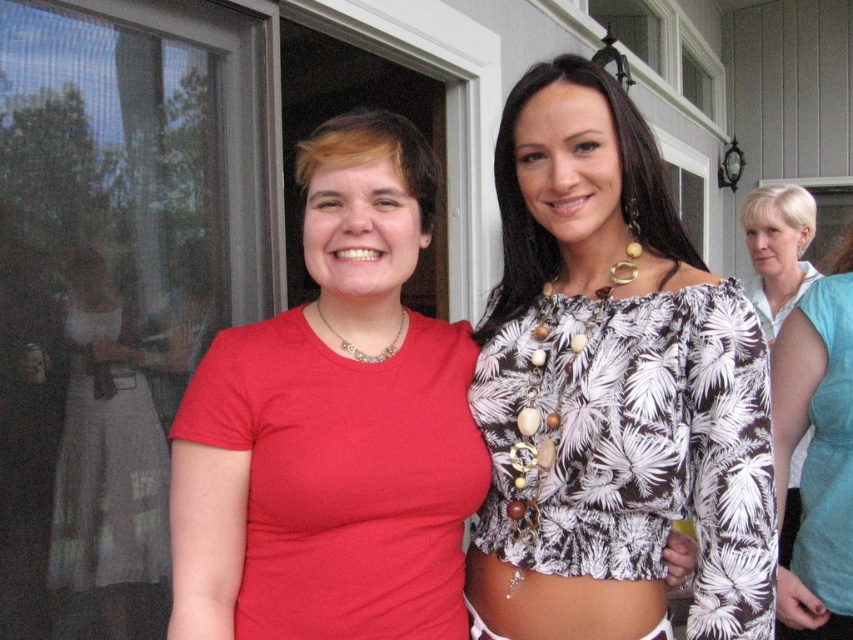
You are a photographer trying to capture a clear shot of both the white lace dress at left and the teal fabric dress at right. Based on their positions, which dress might be partially obscured in the photo?

The teal fabric dress at right is behind the white lace dress at left, so it might be partially obscured in the photo.

You are a photographer setting up for a photoshoot and need to position two models wearing the white lace dress at left and teal fabric dress at right. According to the scene, which dress is placed lower in the frame?

The white lace dress at left is positioned under the teal fabric dress at right, meaning it is lower in the frame.